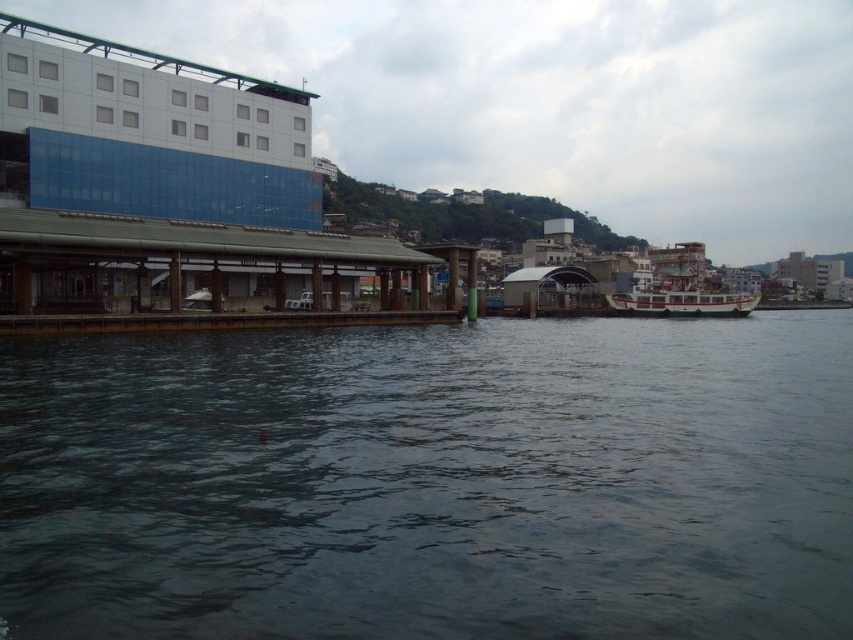
You are standing at the point labeled as point [198,275] in the image. What is the nearest structure to you?

The nearest structure to point [198,275] is the brown wooden dock at lower left, as the point is located on it.

You are standing on the brown wooden dock at lower left and want to reach the dark water at lower center. Based on the scene description, which direction should you move to get to the water?

Since the dark water at lower center is shorter than the brown wooden dock at lower left, you should move downward towards the dark water at lower center to reach it.

You are standing on the brown wooden dock at lower left and want to reach the dark water at lower center. Which direction should you move to get there?

You should move downward, as the dark water at lower center is located below the brown wooden dock at lower left.